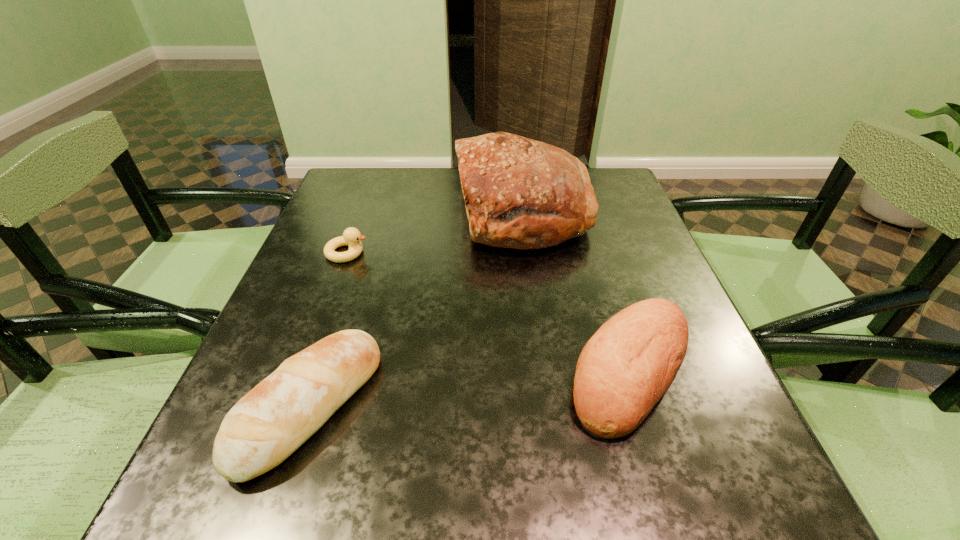
I want to click on object that is at the near edge, so click(277, 416).

Where is `bread present at the left edge`? bread present at the left edge is located at coordinates (277, 416).

Where is `duckling that is at the left edge`? This screenshot has width=960, height=540. duckling that is at the left edge is located at coordinates (351, 237).

This screenshot has height=540, width=960. I want to click on object located in the near left corner section of the desktop, so [x=277, y=416].

Locate an element on the screen. object located at the far right corner is located at coordinates (520, 193).

In the image, there is a desktop. Identify the location of vacant region at the far edge. The height and width of the screenshot is (540, 960). (448, 169).

Where is `vacant area at the near edge of the desktop`? The width and height of the screenshot is (960, 540). vacant area at the near edge of the desktop is located at coordinates (567, 497).

Locate an element on the screen. This screenshot has width=960, height=540. vacant position at the left edge of the desktop is located at coordinates (291, 273).

You are a GUI agent. You are given a task and a screenshot of the screen. Output one action in this format:
    pyautogui.click(x=<x>, y=<y>)
    Task: Click on the vacant space at the right edge of the desktop
    Image resolution: width=960 pixels, height=540 pixels.
    Given the screenshot: What is the action you would take?
    pyautogui.click(x=672, y=408)

In order to click on vacant area at the far left corner of the desktop in this screenshot , I will do `click(365, 179)`.